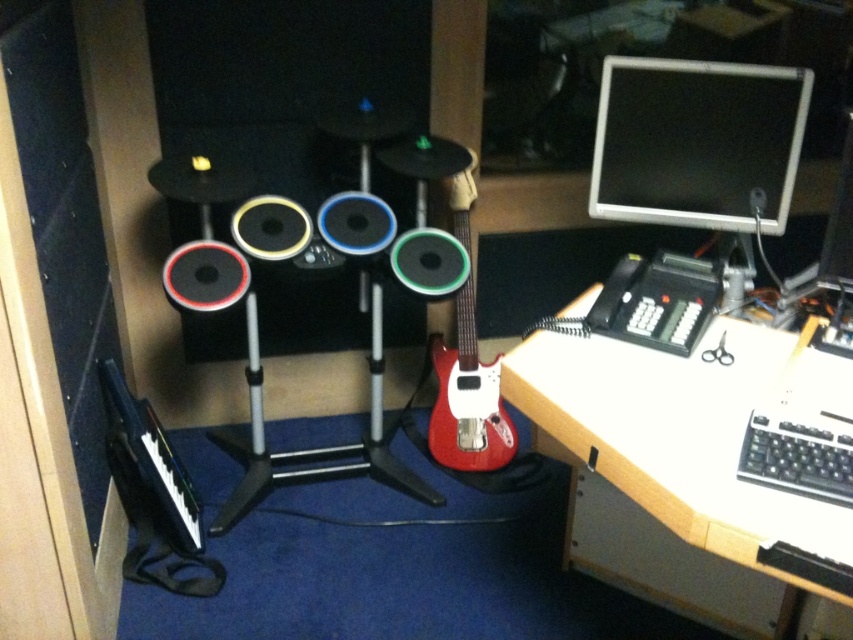
Can you confirm if wooden at right is thinner than glossy red electric guitar at center?

No, wooden at right is not thinner than glossy red electric guitar at center.

The image size is (853, 640). What are the coordinates of `wooden at right` in the screenshot? It's located at (694, 436).

Where is `wooden at right`? This screenshot has width=853, height=640. wooden at right is located at coordinates (694, 436).

Is point (737, 410) farther from camera compared to point (601, 172)?

No, (737, 410) is in front of (601, 172).

Is wooden at right further to the viewer compared to matte silver monitor at upper right?

No, it is not.

The image size is (853, 640). In order to click on wooden at right in this screenshot , I will do `click(694, 436)`.

Does matte silver monitor at upper right lie in front of glossy red electric guitar at center?

Yes, it is.

Can you confirm if matte silver monitor at upper right is positioned to the right of glossy red electric guitar at center?

Yes, matte silver monitor at upper right is to the right of glossy red electric guitar at center.

Does point (625, 76) come closer to viewer compared to point (473, 387)?

That is True.

Find the location of a particular element. The width and height of the screenshot is (853, 640). matte silver monitor at upper right is located at coordinates (695, 141).